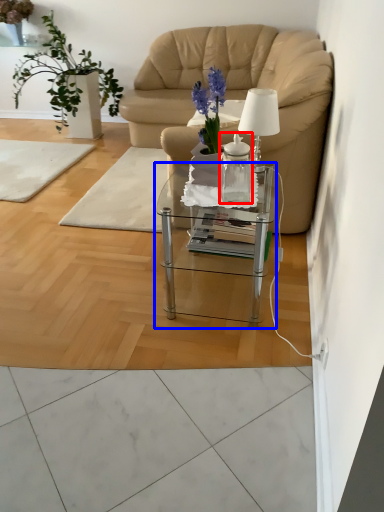
Question: Which object is further to the camera taking this photo, vase (highlighted by a red box) or coffee table (highlighted by a blue box)?

Choices:
 (A) vase
 (B) coffee table

Answer: (A)